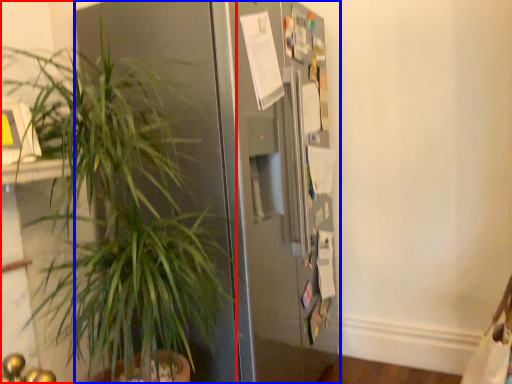
Question: Among these objects, which one is nearest to the camera, houseplant (highlighted by a red box) or refrigerator (highlighted by a blue box)?

Choices:
 (A) houseplant
 (B) refrigerator

Answer: (A)